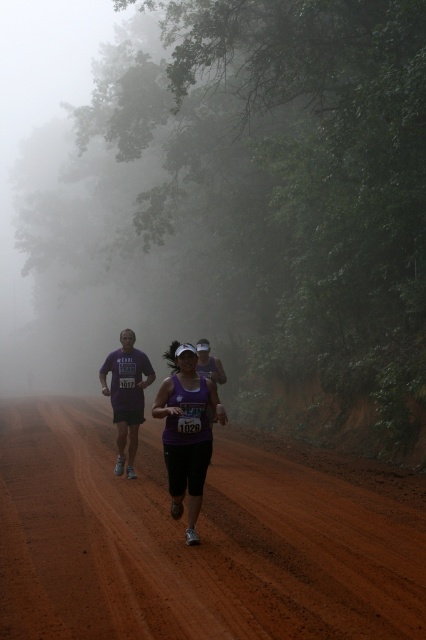
Question: Which is farther from the purple fabric runner at center?

Choices:
 (A) purple fabric tank top at center
 (B) brown dirt track at center

Answer: (A)

Question: Which of the following is the closest to the observer?

Choices:
 (A) purple fabric tank top at center
 (B) brown dirt track at center
 (C) purple fabric runner at center

Answer: (B)

Question: Observing the image, what is the correct spatial positioning of brown dirt track at center in reference to purple fabric runner at center?

Choices:
 (A) below
 (B) above

Answer: (A)

Question: Considering the relative positions of brown dirt track at center and purple fabric tank top at center in the image provided, where is brown dirt track at center located with respect to purple fabric tank top at center?

Choices:
 (A) left
 (B) right

Answer: (A)

Question: Can you confirm if brown dirt track at center is smaller than purple fabric tank top at center?

Choices:
 (A) yes
 (B) no

Answer: (B)

Question: Which of the following is the farthest from the observer?

Choices:
 (A) (126, 396)
 (B) (193, 500)
 (C) (63, 531)

Answer: (A)